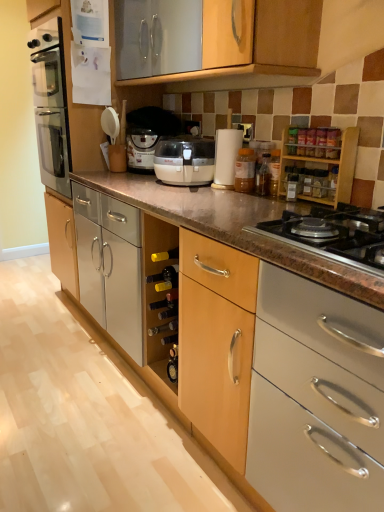
The width and height of the screenshot is (384, 512). What are the coordinates of `empty space that is ontop of wooden spice rack at upper right, the first cabinetry from the right (from a real-world perspective)` in the screenshot? It's located at (323, 127).